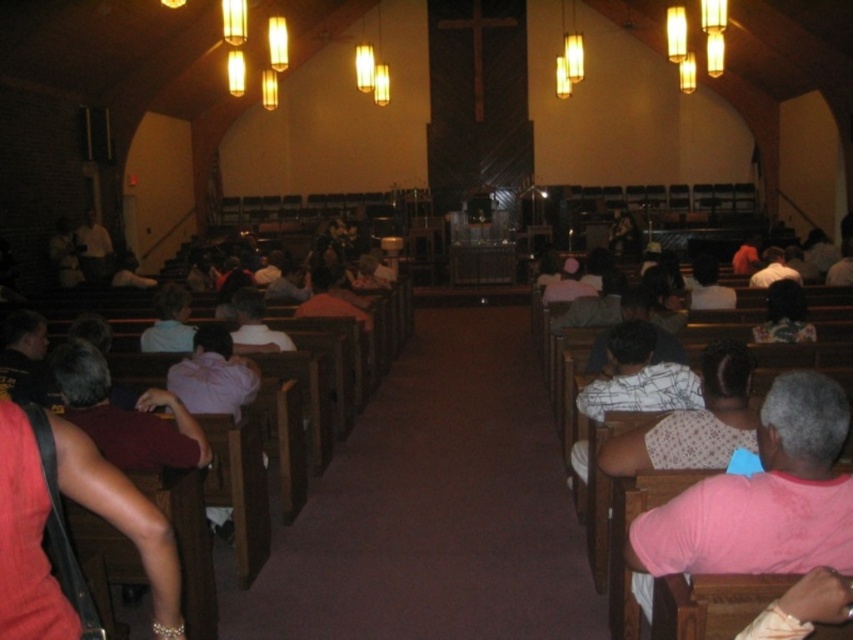
Question: Where is pink fabric shirt at left located in relation to pink fabric shirt at right in the image?

Choices:
 (A) right
 (B) left

Answer: (B)

Question: Which point appears closest to the camera in this image?

Choices:
 (A) (811, 333)
 (B) (10, 413)

Answer: (B)

Question: Is pink fabric shirt at left positioned before pink fabric shirt at right?

Choices:
 (A) no
 (B) yes

Answer: (B)

Question: Does pink fabric shirt at left appear on the right side of pink fabric shirt at right?

Choices:
 (A) no
 (B) yes

Answer: (A)